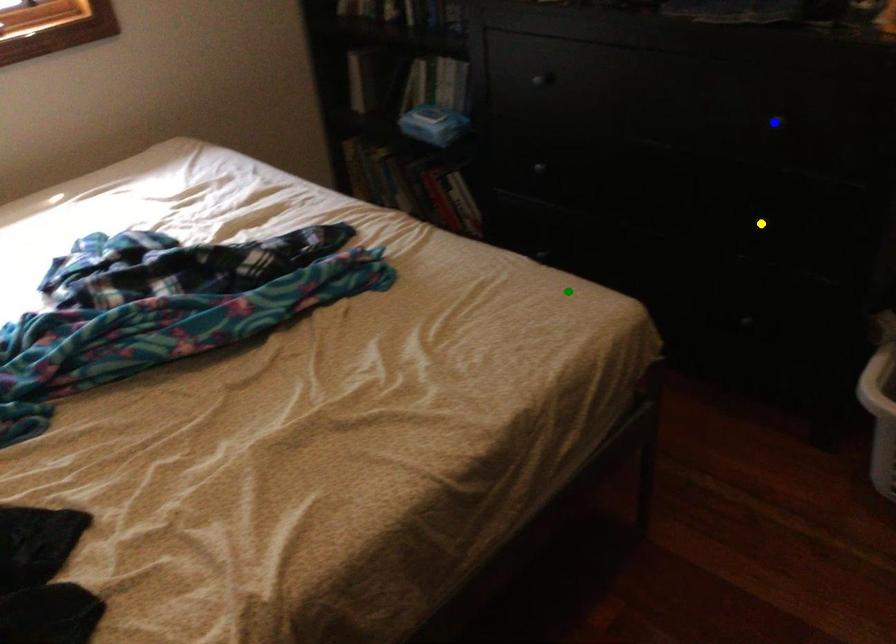
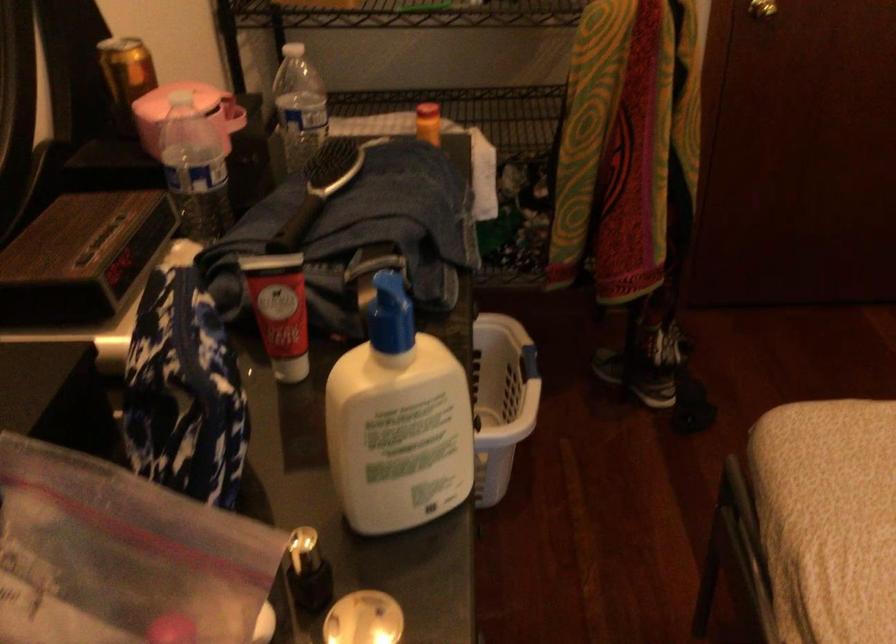
I am providing you with two images of the same scene from different viewpoints. Three points are marked in image1. Which point corresponds to a part or object that is occluded in image2?In image1, three points are marked. Which of them correspond to a part or object that is occluded in image2?Among the three points shown in image1, which one corresponds to a part or object that is no longer visible due to occlusion in image2?

Invisible in image2: blue point, yellow point.